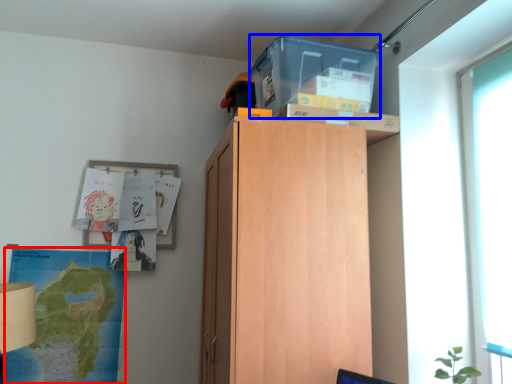
Question: Among these objects, which one is nearest to the camera, map (highlighted by a red box) or storage box (highlighted by a blue box)?

Choices:
 (A) map
 (B) storage box

Answer: (B)